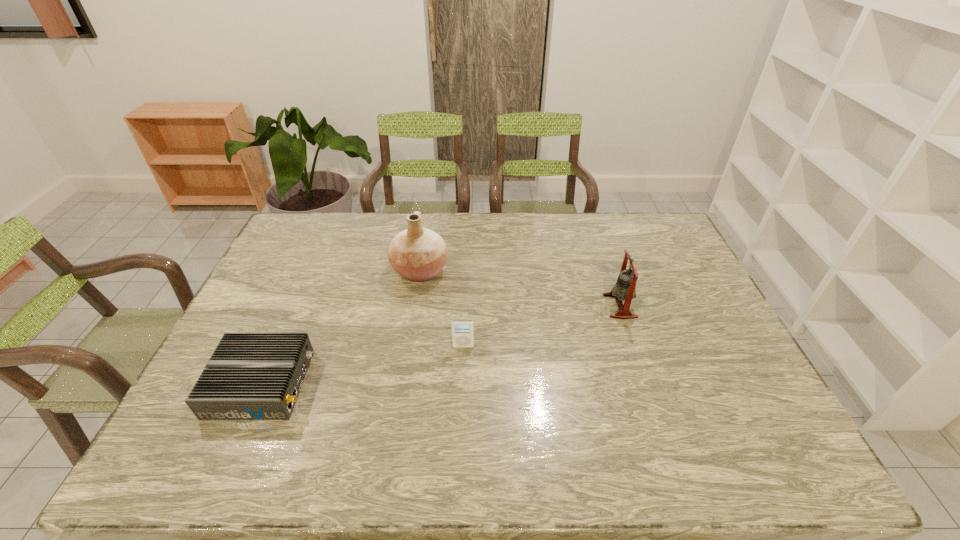
Identify the location of free space between the shortest object and the farthest object. (341, 327).

This screenshot has width=960, height=540. Identify the location of vacant space that's between the router and the second shortest object. (363, 365).

You are a GUI agent. You are given a task and a screenshot of the screen. Output one action in this format:
    pyautogui.click(x=<x>, y=<y>)
    Task: Click on the vacant point located between the iPod and the third object from right to left
    Image resolution: width=960 pixels, height=540 pixels.
    Given the screenshot: What is the action you would take?
    pyautogui.click(x=442, y=308)

At what (x,y) coordinates should I click in order to perform the action: click on empty space between the rightmost object and the third object from left to right. Please return your answer as a coordinate pair (x, y). The width and height of the screenshot is (960, 540). Looking at the image, I should click on (541, 326).

Identify the location of empty space between the farthest object and the shortest object. (341, 327).

Locate an element on the screen. The width and height of the screenshot is (960, 540). vacant point located between the third object from left to right and the bell is located at coordinates (541, 326).

The image size is (960, 540). Identify the location of unoccupied position between the third object from left to right and the nearest object. (363, 365).

Locate an element on the screen. empty location between the shortest object and the iPod is located at coordinates (363, 365).

What are the coordinates of `the second closest object to the rightmost object` in the screenshot? It's located at (418, 254).

Select which object appears as the second closest to the second nearest object. Please provide its 2D coordinates. Your answer should be formatted as a tuple, i.e. [(x, y)], where the tuple contains the x and y coordinates of a point satisfying the conditions above.

[(250, 376)]